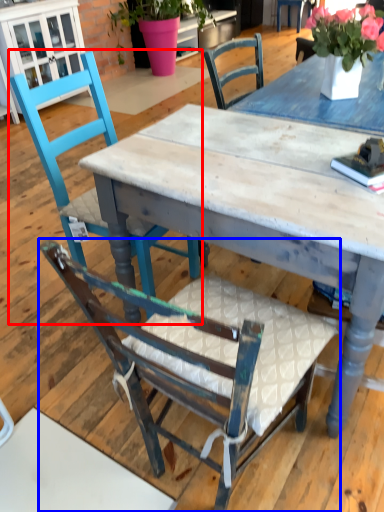
Question: Which point is closer to the camera, chair (highlighted by a red box) or chair (highlighted by a blue box)?

Choices:
 (A) chair
 (B) chair

Answer: (B)